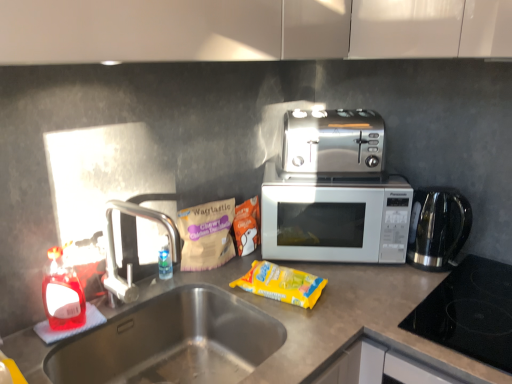
What do you see at coordinates (333, 141) in the screenshot? The image size is (512, 384). I see `satin silver toaster at center` at bounding box center [333, 141].

What do you see at coordinates (172, 342) in the screenshot? I see `stainless steel sink at lower left` at bounding box center [172, 342].

What are the coordinates of `black glass cooktop at lower right` in the screenshot? It's located at (470, 312).

You are a GUI agent. You are given a task and a screenshot of the screen. Output one action in this format:
    pyautogui.click(x=<x>, y=<y>)
    Task: Click on the translucent plastic bottle at sink left
    
    Given the screenshot: What is the action you would take?
    pyautogui.click(x=62, y=294)

Where is `matte brown packet of waglastic chewy chicken treats at sink left, placed as the 3th snack when sorted from right to left`? The width and height of the screenshot is (512, 384). matte brown packet of waglastic chewy chicken treats at sink left, placed as the 3th snack when sorted from right to left is located at coordinates (206, 235).

From a real-world perspective, which object rests below the other?

yellow plastic packet at center, arranged as the 3th snack when viewed from the left, from a real-world perspective.

Which is less distant, (x=414, y=215) or (x=300, y=284)?

The point (x=300, y=284) is closer to the camera.

Is stainless steel kettle at right bigger than yellow plastic packet at center, the first snack in the right-to-left sequence?

Yes.

Between stainless steel kettle at right and yellow plastic packet at center, arranged as the 3th snack when viewed from the left, which one appears on the left side from the viewer's perspective?

yellow plastic packet at center, arranged as the 3th snack when viewed from the left, is more to the left.

Can you see black glass cooktop at lower right touching silver metallic microwave at center?

There is a gap between black glass cooktop at lower right and silver metallic microwave at center.

Looking at this image, which is closer, [500,297] or [355,196]?

Point [500,297] is positioned closer to the camera compared to point [355,196].

Where is `gas stove below the silver metallic microwave at center (from the image's perspective)`? This screenshot has height=384, width=512. gas stove below the silver metallic microwave at center (from the image's perspective) is located at coordinates (470, 312).

Considering the points (269, 272) and (343, 150), which point is in front, point (269, 272) or point (343, 150)?

The point (269, 272) is closer to the camera.

Does yellow plastic packet at center, the first snack in the right-to-left sequence, turn towards satin silver toaster at center?

No.

From a real-world perspective, which is physically below, yellow plastic packet at center, arranged as the 3th snack when viewed from the left, or satin silver toaster at center?

yellow plastic packet at center, arranged as the 3th snack when viewed from the left.

Considering the positions of point (340, 140) and point (197, 256), is point (340, 140) closer or farther from the camera than point (197, 256)?

Point (340, 140) is closer to the camera than point (197, 256).

Would you consider satin silver toaster at center to be distant from matte brown packet of waglastic chewy chicken treats at sink left, which is the 1th snack from left to right?

No, satin silver toaster at center is not far from matte brown packet of waglastic chewy chicken treats at sink left, which is the 1th snack from left to right.

In the scene shown: Choose the correct answer: Is satin silver toaster at center inside matte brown packet of waglastic chewy chicken treats at sink left, placed as the 3th snack when sorted from right to left, or outside it?

The correct answer is: outside.

Is satin silver toaster at center at the right side of matte brown packet of waglastic chewy chicken treats at sink left, which is the 1th snack from left to right?

Correct, you'll find satin silver toaster at center to the right of matte brown packet of waglastic chewy chicken treats at sink left, which is the 1th snack from left to right.

Does point (309, 275) come closer to viewer compared to point (222, 232)?

Yes.

From a real-world perspective, between yellow plastic packet at center, arranged as the 3th snack when viewed from the left, and matte brown packet of waglastic chewy chicken treats at sink left, placed as the 3th snack when sorted from right to left, who is vertically higher?

matte brown packet of waglastic chewy chicken treats at sink left, placed as the 3th snack when sorted from right to left, is physically above.

Between yellow plastic packet at center, arranged as the 3th snack when viewed from the left, and matte brown packet of waglastic chewy chicken treats at sink left, which is the 1th snack from left to right, which one appears on the right side from the viewer's perspective?

Positioned to the right is yellow plastic packet at center, arranged as the 3th snack when viewed from the left.

Can you confirm if translucent plastic bottle at sink left is wider than stainless steel sink at lower left?

No.

Does point (45, 300) lie behind point (187, 288)?

That is False.

Looking at this image, could you tell me if translucent plastic bottle at sink left is turned towards stainless steel sink at lower left?

No.

This screenshot has height=384, width=512. I want to click on faucet on the left side of matte brown packet of waglastic chewy chicken treats at sink left, placed as the 3th snack when sorted from right to left, so click(130, 263).

Does silver metallic faucet at left lie in front of matte brown packet of waglastic chewy chicken treats at sink left, which is the 1th snack from left to right?

Yes.

Considering the relative sizes of silver metallic faucet at left and matte brown packet of waglastic chewy chicken treats at sink left, which is the 1th snack from left to right, in the image provided, is silver metallic faucet at left thinner than matte brown packet of waglastic chewy chicken treats at sink left, which is the 1th snack from left to right,?

Incorrect, the width of silver metallic faucet at left is not less than that of matte brown packet of waglastic chewy chicken treats at sink left, which is the 1th snack from left to right.

How much distance is there between silver metallic faucet at left and matte brown packet of waglastic chewy chicken treats at sink left, which is the 1th snack from left to right?

5.58 inches.

Locate an element on the screen. Image resolution: width=512 pixels, height=384 pixels. appliance behind the yellow plastic packet at center, the first snack in the right-to-left sequence is located at coordinates (437, 227).

Where is `gas stove below the silver metallic microwave at center (from the image's perspective)`? Image resolution: width=512 pixels, height=384 pixels. gas stove below the silver metallic microwave at center (from the image's perspective) is located at coordinates (470, 312).

Which object lies further to the anchor point silver metallic faucet at left, stainless steel kettle at right or silver metallic microwave at center?

Among the two, stainless steel kettle at right is located further to silver metallic faucet at left.

From the image, which object appears to be nearer to yellow plastic packet at center, the first snack in the right-to-left sequence, silver metallic microwave at center or stainless steel kettle at right?

silver metallic microwave at center lies closer to yellow plastic packet at center, the first snack in the right-to-left sequence, than the other object.

Based on the photo, when comparing their distances from matte brown packet of waglastic chewy chicken treats at sink left, placed as the 3th snack when sorted from right to left, does stainless steel sink at lower left or yellow plastic packet at center, the first snack in the right-to-left sequence, seem closer?

stainless steel sink at lower left lies closer to matte brown packet of waglastic chewy chicken treats at sink left, placed as the 3th snack when sorted from right to left, than the other object.

Which object lies further to the anchor point silver metallic microwave at center, matte brown packet of snacks at center, which appears as the second snack when viewed from the right, or yellow plastic packet at center, arranged as the 3th snack when viewed from the left?

Based on the image, matte brown packet of snacks at center, which appears as the second snack when viewed from the right, appears to be further to silver metallic microwave at center.

From the image, which object appears to be nearer to stainless steel sink at lower left, matte brown packet of snacks at center, which appears as the second snack when viewed from the right, or satin silver toaster at center?

matte brown packet of snacks at center, which appears as the second snack when viewed from the right.

Considering their positions, is satin silver toaster at center positioned closer to silver metallic microwave at center than silver metallic faucet at left?

The object closer to silver metallic microwave at center is satin silver toaster at center.

Estimate the real-world distances between objects in this image. Which object is further from silver metallic microwave at center, silver metallic faucet at left or black glass cooktop at lower right?

The object further to silver metallic microwave at center is silver metallic faucet at left.

Which object lies further to the anchor point satin silver toaster at center, yellow plastic packet at center, arranged as the 3th snack when viewed from the left, or translucent plastic bottle at sink left?

translucent plastic bottle at sink left is positioned further to the anchor satin silver toaster at center.

This screenshot has width=512, height=384. In order to click on faucet between translucent plastic bottle at sink left and matte brown packet of waglastic chewy chicken treats at sink left, which is the 1th snack from left to right in this screenshot , I will do `click(130, 263)`.

At what (x,y) coordinates should I click in order to perform the action: click on faucet located between stainless steel sink at lower left and matte brown packet of waglastic chewy chicken treats at sink left, placed as the 3th snack when sorted from right to left, in the depth direction. Please return your answer as a coordinate pair (x, y). Image resolution: width=512 pixels, height=384 pixels. Looking at the image, I should click on (130, 263).

Find the location of a particular element. The height and width of the screenshot is (384, 512). toaster situated between yellow plastic packet at center, the first snack in the right-to-left sequence, and black glass cooktop at lower right from left to right is located at coordinates (333, 141).

Where is `microwave oven located between silver metallic faucet at left and black glass cooktop at lower right in the left-right direction`? microwave oven located between silver metallic faucet at left and black glass cooktop at lower right in the left-right direction is located at coordinates (335, 218).